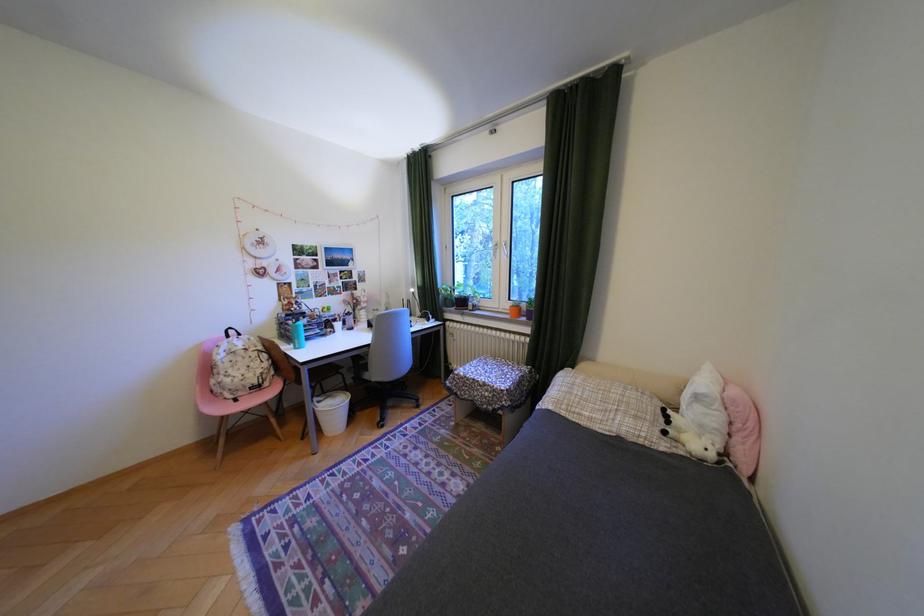
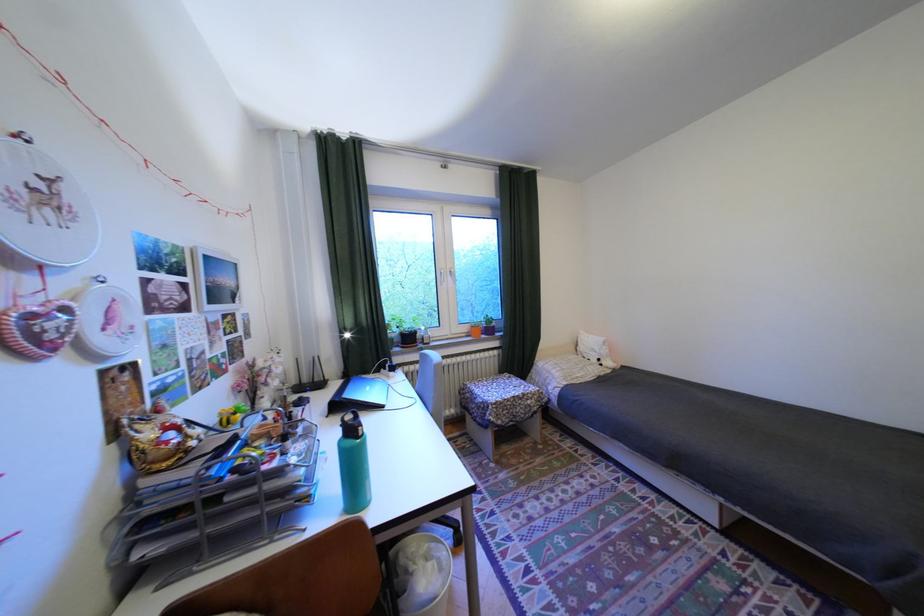
In the second image, find the point that corresponds to pixel 507 257 in the first image.

(454, 285)